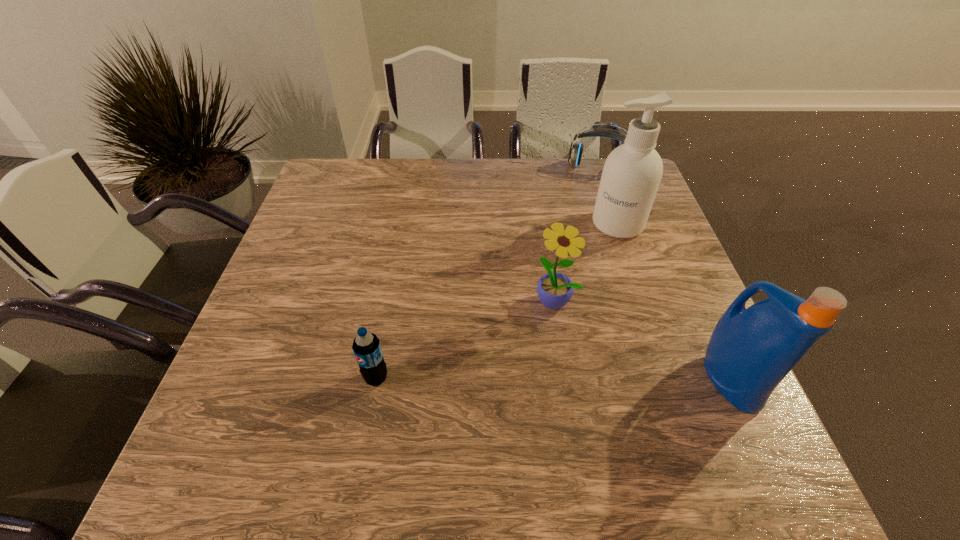
At what (x,y) coordinates should I click in order to perform the action: click on free spot located 0.210m on the front label of the fourth nearest object. Please return your answer as a coordinate pair (x, y). Looking at the image, I should click on (580, 288).

You are a GUI agent. You are given a task and a screenshot of the screen. Output one action in this format:
    pyautogui.click(x=<x>, y=<y>)
    Task: Click on the vacant space situated on the ear cups of the headset
    The image size is (960, 540).
    Given the screenshot: What is the action you would take?
    pyautogui.click(x=588, y=212)

At what (x,y) coordinates should I click in order to perform the action: click on vacant space located on the ear cups of the headset. Please return your answer as a coordinate pair (x, y). This screenshot has width=960, height=540. Looking at the image, I should click on (591, 191).

Locate an element on the screen. This screenshot has width=960, height=540. vacant space located 0.180m on the ear cups of the headset is located at coordinates (588, 212).

I want to click on vacant space located 0.300m on the front-facing side of the third farthest object, so click(490, 427).

Locate an element on the screen. The height and width of the screenshot is (540, 960). free space located on the front-facing side of the third farthest object is located at coordinates (523, 361).

Find the location of `vacant area located on the front-facing side of the third farthest object`. vacant area located on the front-facing side of the third farthest object is located at coordinates (503, 400).

This screenshot has height=540, width=960. I want to click on object located at the far edge, so click(575, 152).

Locate an element on the screen. soda bottle positioned at the near edge is located at coordinates (366, 346).

Locate an element on the screen. This screenshot has height=540, width=960. detergent that is at the near edge is located at coordinates (750, 352).